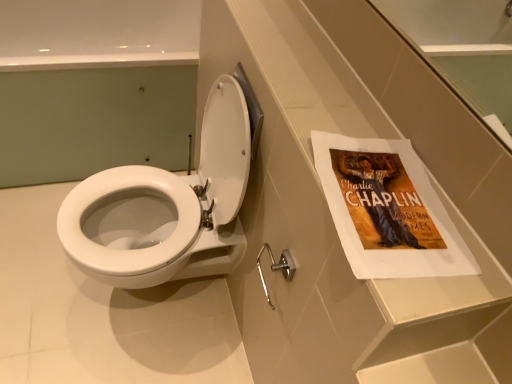
Question: Is silver metallic towel bar at lower center bigger or smaller than white glossy toilet at center?

Choices:
 (A) big
 (B) small

Answer: (B)

Question: Based on their positions, is silver metallic towel bar at lower center located to the left or right of white glossy toilet at center?

Choices:
 (A) left
 (B) right

Answer: (B)

Question: Which is nearer to the white glossy toilet at center?

Choices:
 (A) white glossy toilet at center
 (B) silver metallic towel bar at lower center

Answer: (A)

Question: Which object is the closest to the white glossy toilet at center?

Choices:
 (A) silver metallic towel bar at lower center
 (B) white glossy toilet at center

Answer: (B)